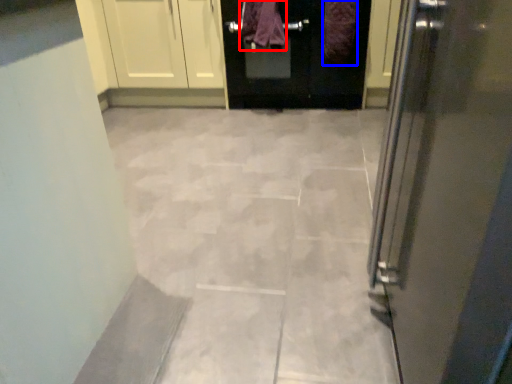
Question: Among these objects, which one is farthest to the camera, blanket (highlighted by a red box) or blanket (highlighted by a blue box)?

Choices:
 (A) blanket
 (B) blanket

Answer: (A)